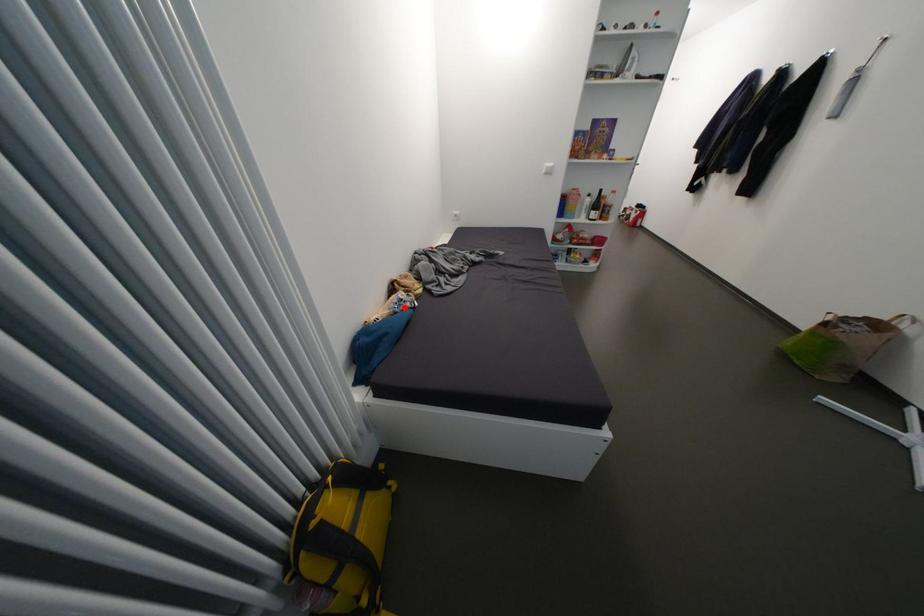
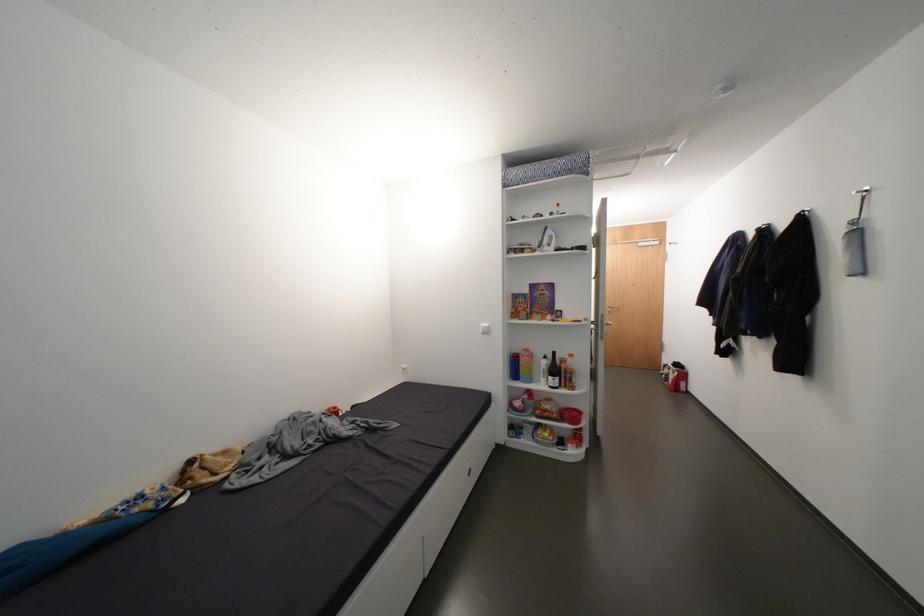
Locate, in the second image, the point that corresponds to the highlighted location in the first image.

(131, 508)